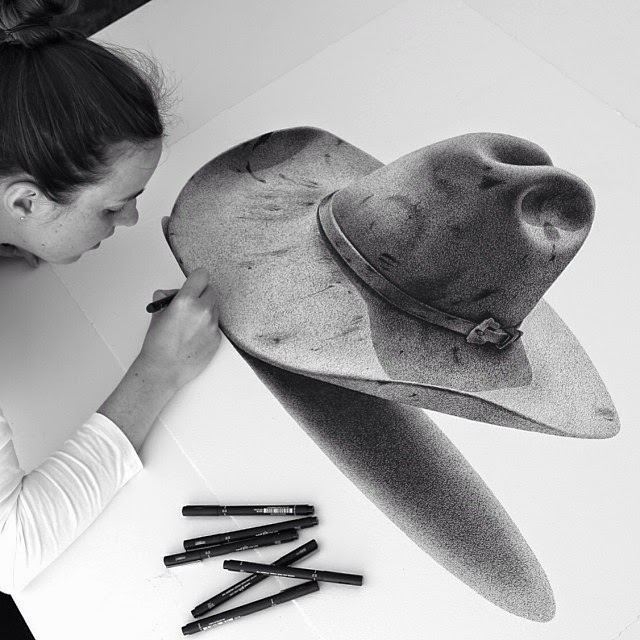
Find the location of a particular element. This screenshot has width=640, height=640. six pens on table is located at coordinates (280, 598), (340, 575), (233, 592), (275, 546), (289, 525), (294, 509).